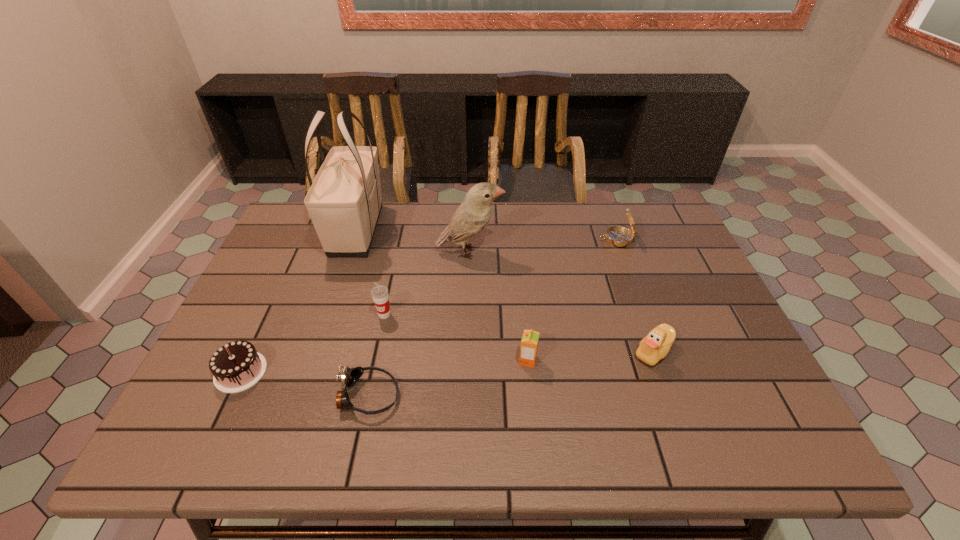
Identify the location of shopping bag. coord(344,202).

The image size is (960, 540). I want to click on the tallest object, so click(344, 202).

In order to click on bird in this screenshot , I will do `click(471, 217)`.

In order to click on the fourth object from right to left in this screenshot , I will do `click(471, 217)`.

The height and width of the screenshot is (540, 960). I want to click on cup, so click(379, 293).

Where is `compass`? The image size is (960, 540). compass is located at coordinates (618, 236).

Image resolution: width=960 pixels, height=540 pixels. Identify the location of the third object from right to left. (529, 344).

Locate an element on the screen. This screenshot has height=540, width=960. duck is located at coordinates (655, 346).

The height and width of the screenshot is (540, 960). I want to click on the leftmost object, so click(236, 366).

Image resolution: width=960 pixels, height=540 pixels. Identify the location of goggles. (349, 376).